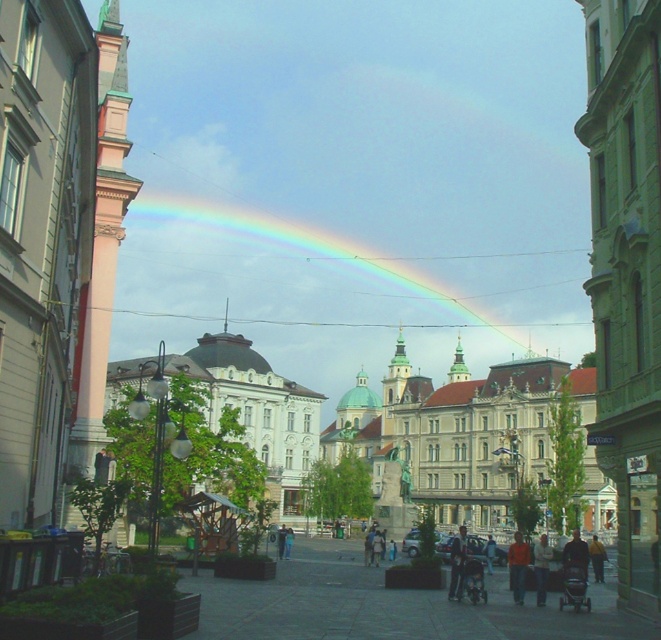
Question: Does orange cotton shirt at lower right come behind light brown leather jacket at lower center?

Choices:
 (A) no
 (B) yes

Answer: (B)

Question: Among these points, which one is farthest from the camera?

Choices:
 (A) (381, 276)
 (B) (451, 545)
 (C) (514, 563)
 (D) (543, 566)

Answer: (A)

Question: Which of the following is the farthest from the observer?

Choices:
 (A) (449, 582)
 (B) (522, 566)

Answer: (A)

Question: Where is white stone building at center located in relation to dark blue jeans at center in the image?

Choices:
 (A) left
 (B) right

Answer: (A)

Question: Estimate the real-world distances between objects in this image. Which object is closer to the dark blue jeans at center?

Choices:
 (A) rainbow at center
 (B) white stone building at center
 (C) orange cotton shirt at lower right
 (D) light brown leather jacket at lower center

Answer: (C)

Question: Can you confirm if rainbow at center is thinner than light brown leather jacket at lower center?

Choices:
 (A) no
 (B) yes

Answer: (A)